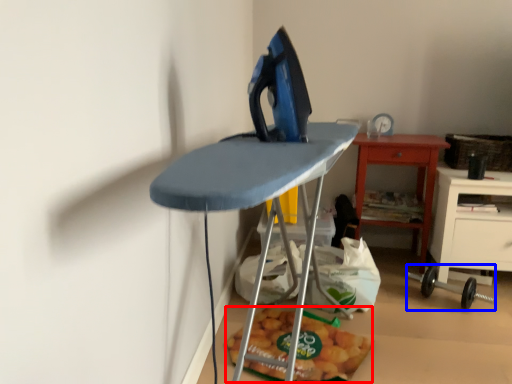
Question: Which of the following is the closest to the observer, food (highlighted by a red box) or equipment (highlighted by a blue box)?

Choices:
 (A) food
 (B) equipment

Answer: (A)